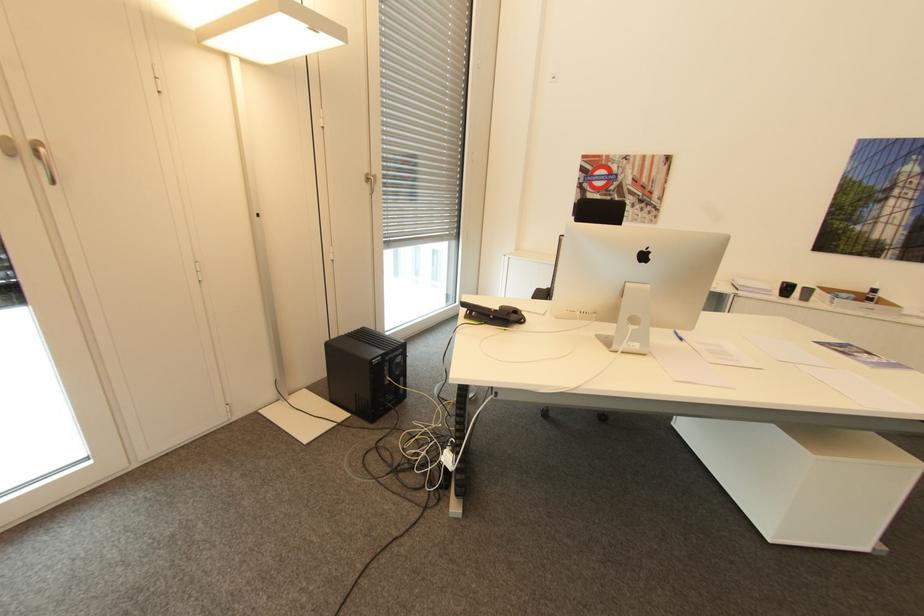
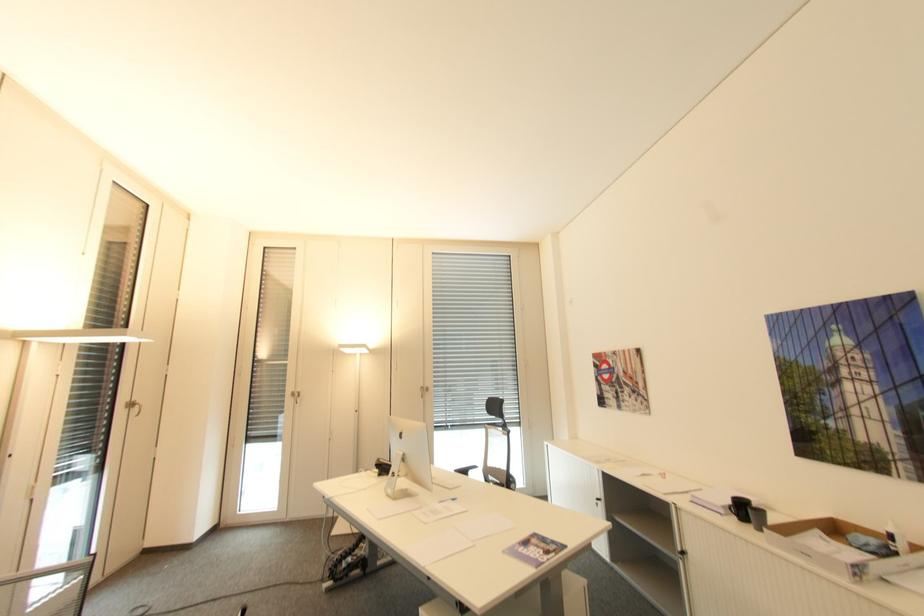
Locate, in the second image, the point that corresponds to point 812,289 in the first image.

(766, 513)